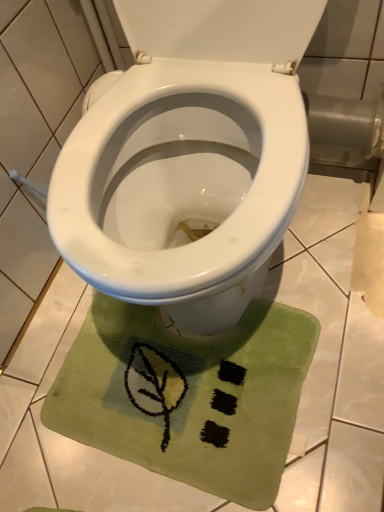
This screenshot has width=384, height=512. Describe the element at coordinates (188, 395) in the screenshot. I see `green plush bath mat at center` at that location.

Find the location of `green plush bath mat at center`. green plush bath mat at center is located at coordinates (188, 395).

What is the approximate height of green plush bath mat at center?

The height of green plush bath mat at center is 3.68 centimeters.

Identify the location of green plush bath mat at center. Image resolution: width=384 pixels, height=512 pixels. (188, 395).